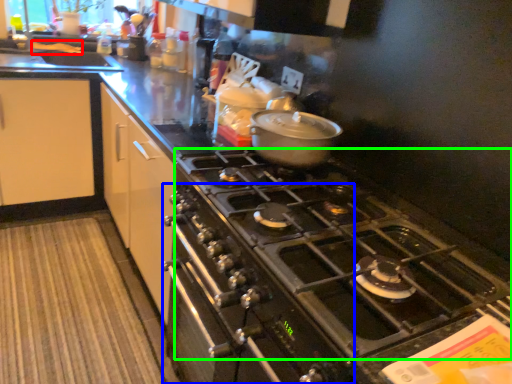
Question: Which object is the closest to the food (highlighted by a red box)? Choose among these: oven (highlighted by a blue box) or gas stove (highlighted by a green box).

Choices:
 (A) oven
 (B) gas stove

Answer: (A)